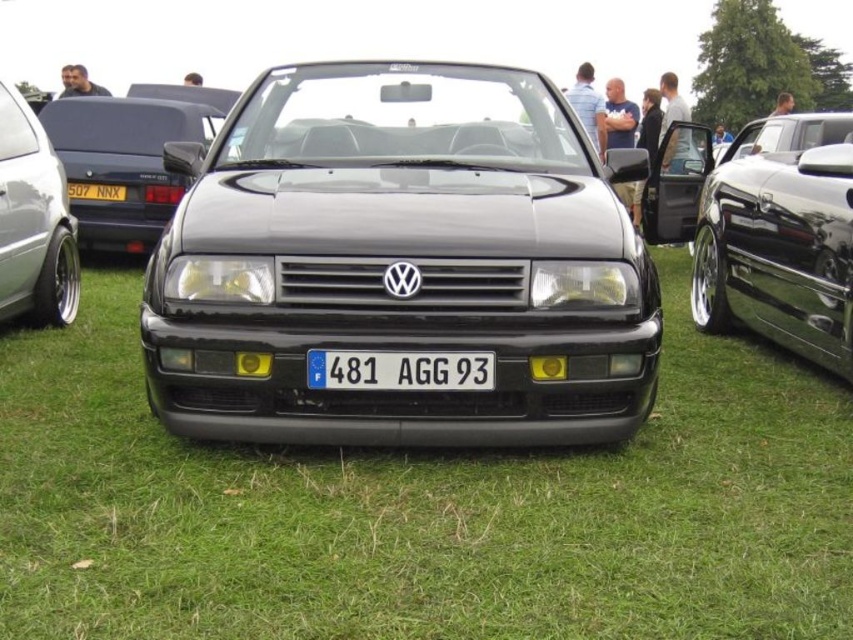
Question: Can you confirm if green grass at center is wider than black plastic license plate at center?

Choices:
 (A) yes
 (B) no

Answer: (A)

Question: Which point is closer to the camera?

Choices:
 (A) glossy black convertible at center
 (B) glossy black car at center
 (C) green grass at center

Answer: (C)

Question: Which object is the closest to the glossy black car at center?

Choices:
 (A) black plastic license plate at center
 (B) green grass at center
 (C) white plastic license plate at center
 (D) glossy black convertible at center

Answer: (C)

Question: Which point is closer to the camera?

Choices:
 (A) green grass at center
 (B) glossy black convertible at center

Answer: (A)

Question: Is matte black car at left smaller than black plastic license plate at center?

Choices:
 (A) no
 (B) yes

Answer: (A)

Question: Does green grass at center have a lesser width compared to white plastic license plate at center?

Choices:
 (A) no
 (B) yes

Answer: (A)